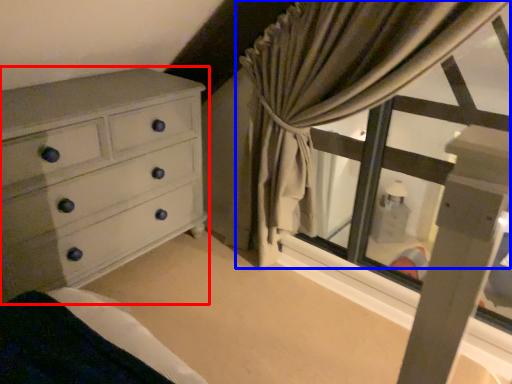
Question: Which of the following is the closest to the observer, chest of drawers (highlighted by a red box) or curtain (highlighted by a blue box)?

Choices:
 (A) chest of drawers
 (B) curtain

Answer: (B)